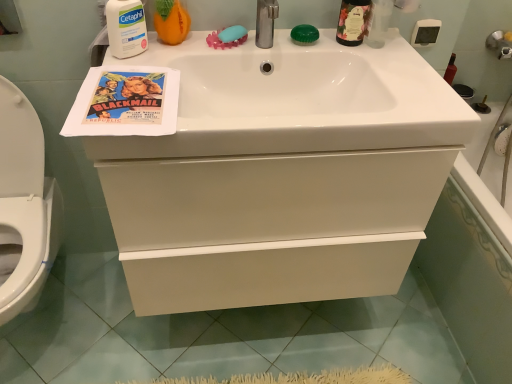
You are a GUI agent. You are given a task and a screenshot of the screen. Output one action in this format:
    pyautogui.click(x=<x>, y=<y>)
    Task: Click on the vacant space in front of matte orange pumpkin at upper left, the first cleaning product positioned from the right
    
    Given the screenshot: What is the action you would take?
    pyautogui.click(x=151, y=66)